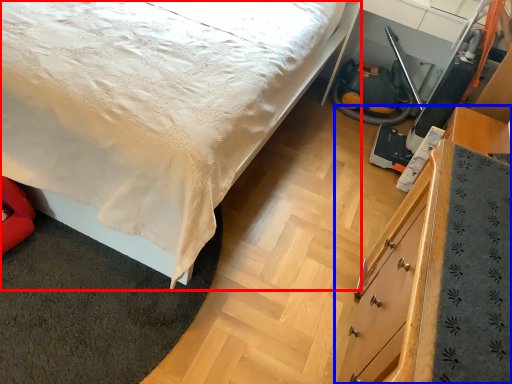
Question: Which of the following is the closest to the observer, bed (highlighted by a red box) or chest of drawers (highlighted by a blue box)?

Choices:
 (A) bed
 (B) chest of drawers

Answer: (B)